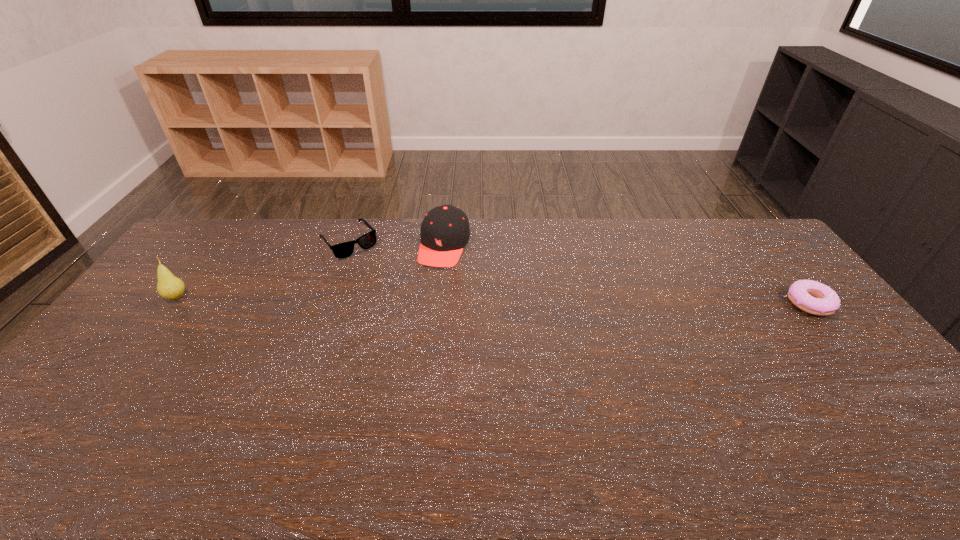
Where is `the leftmost object`? The width and height of the screenshot is (960, 540). the leftmost object is located at coordinates (169, 287).

What are the coordinates of `the shortest object` in the screenshot? It's located at (812, 297).

Image resolution: width=960 pixels, height=540 pixels. In order to click on the rightmost object in this screenshot , I will do `click(812, 297)`.

Where is `cap`? The image size is (960, 540). cap is located at coordinates (445, 231).

Where is `the third shortest object`? The width and height of the screenshot is (960, 540). the third shortest object is located at coordinates (445, 231).

Where is `the second object from left to right`? The image size is (960, 540). the second object from left to right is located at coordinates (342, 250).

At what (x,y) coordinates should I click in order to perform the action: click on sunglasses. Please return your answer as a coordinate pair (x, y). Looking at the image, I should click on (342, 250).

You are a GUI agent. You are given a task and a screenshot of the screen. Output one action in this format:
    pyautogui.click(x=<x>, y=<y>)
    Task: Click on the free space located on the back of the pear
    
    Given the screenshot: What is the action you would take?
    pyautogui.click(x=210, y=253)

Find the location of `vacant space situated 0.370m on the left of the shortest object`. vacant space situated 0.370m on the left of the shortest object is located at coordinates (671, 303).

Where is `free space located 0.140m on the front-facing side of the second tallest object`? This screenshot has width=960, height=540. free space located 0.140m on the front-facing side of the second tallest object is located at coordinates (427, 297).